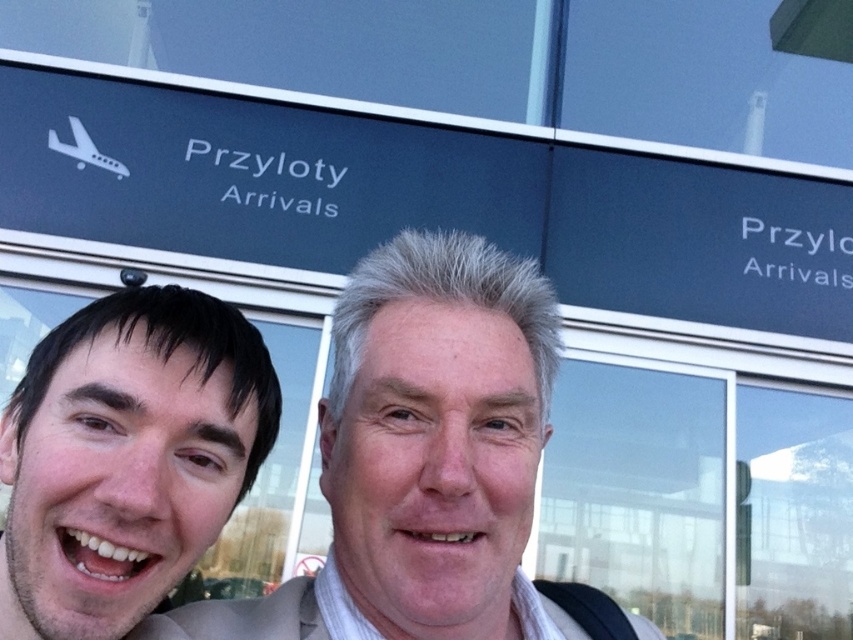
Between smooth skin face at center and smooth skin face at left, which one appears on the right side from the viewer's perspective?

From the viewer's perspective, smooth skin face at center appears more on the right side.

Is smooth skin face at center positioned at the back of smooth skin face at left?

Yes, it is behind smooth skin face at left.

Image resolution: width=853 pixels, height=640 pixels. I want to click on smooth skin face at center, so click(421, 458).

Find the location of a particular element. The width and height of the screenshot is (853, 640). smooth skin face at center is located at coordinates (421, 458).